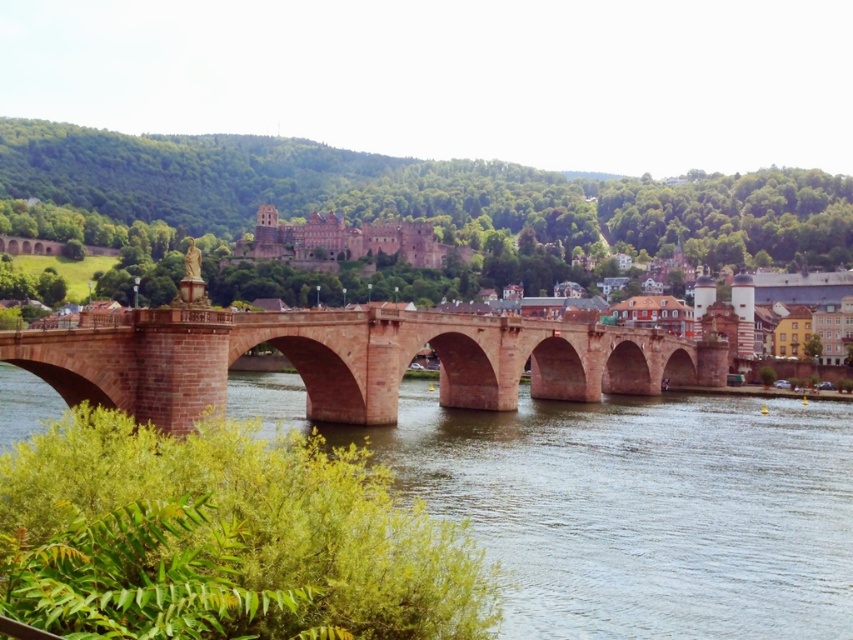
Question: Which object is positioned farthest from the reddish-brown stone bridge at center?

Choices:
 (A) brown stone bridge at center
 (B) brown stone river at center

Answer: (A)

Question: Which of these objects is positioned closest to the brown stone river at center?

Choices:
 (A) brown stone bridge at center
 (B) reddish-brown stone bridge at center

Answer: (B)

Question: Does reddish-brown stone bridge at center have a greater width compared to brown stone bridge at center?

Choices:
 (A) no
 (B) yes

Answer: (A)

Question: Does reddish-brown stone bridge at center appear on the right side of brown stone bridge at center?

Choices:
 (A) yes
 (B) no

Answer: (A)

Question: Is brown stone river at center wider than reddish-brown stone bridge at center?

Choices:
 (A) no
 (B) yes

Answer: (B)

Question: Which object is the closest to the brown stone bridge at center?

Choices:
 (A) reddish-brown stone bridge at center
 (B) brown stone river at center

Answer: (B)